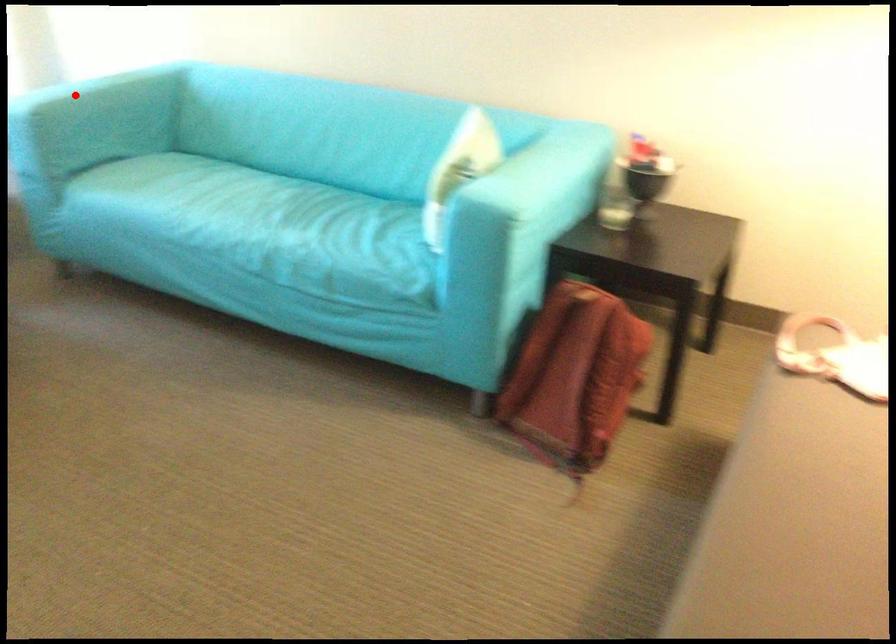
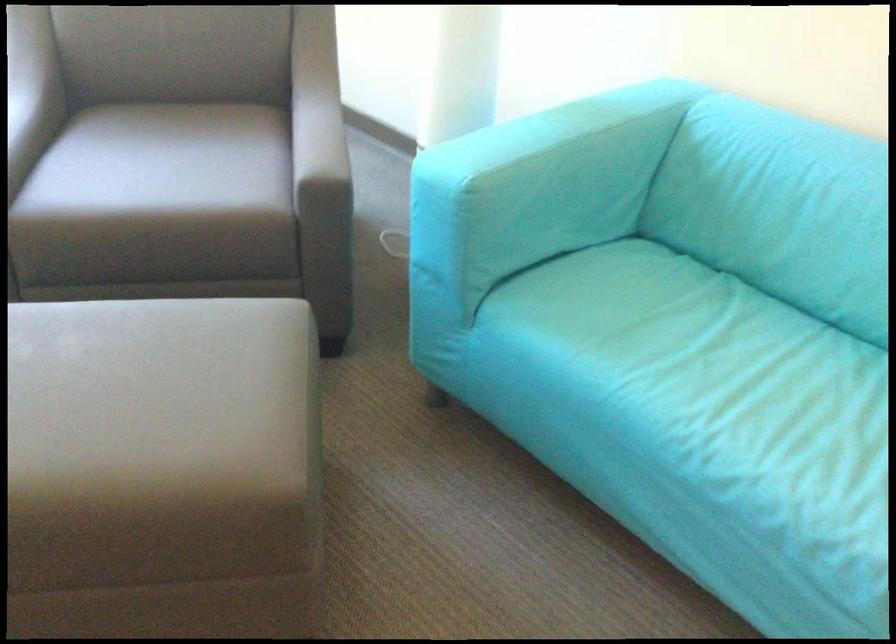
Question: I am providing you with two images of the same scene from different viewpoints. In image1, a red point is highlighted. Considering the same 3D point in image2, which of the following is correct?

Choices:
 (A) It is closer
 (B) It is farther

Answer: (A)